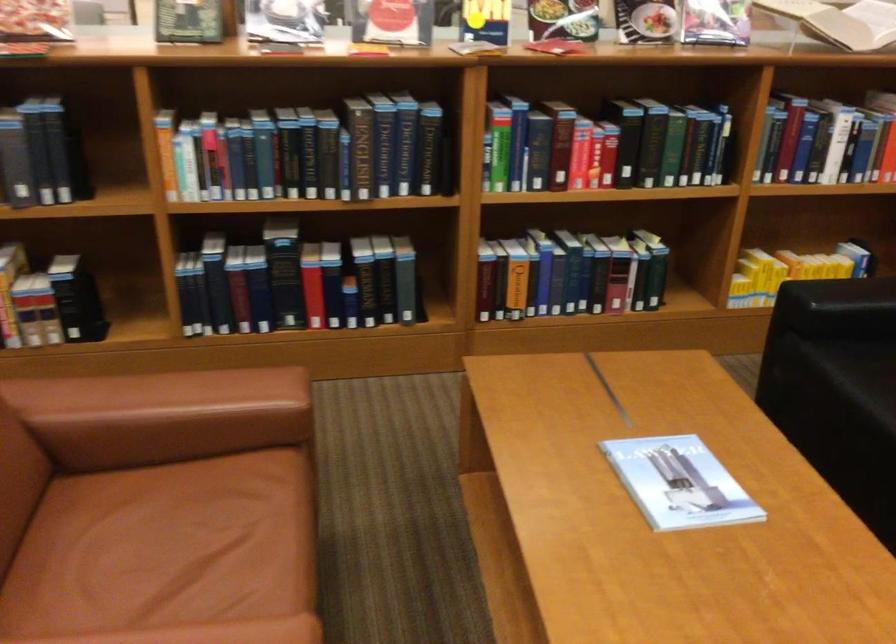
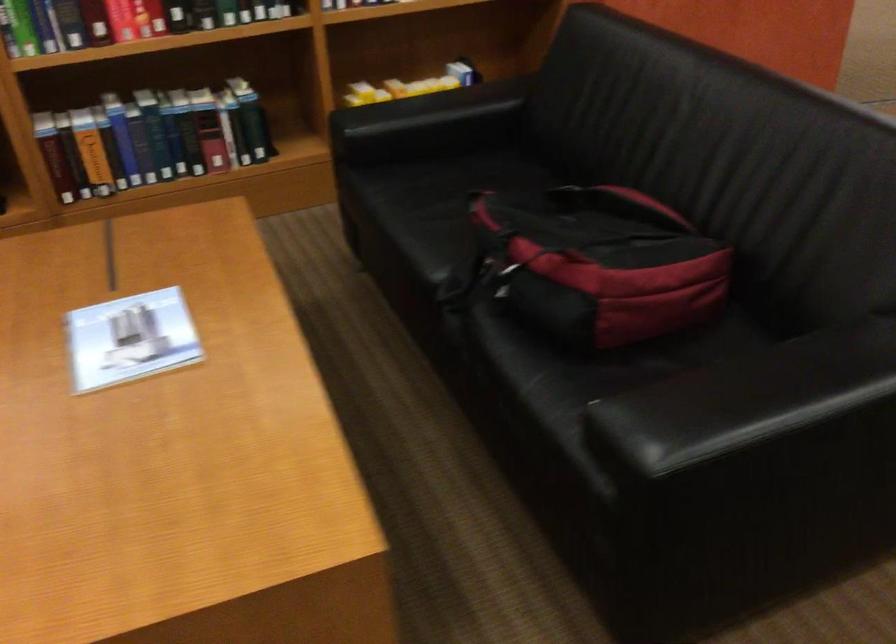
Find the pixel in the second image that matches pixel 664 480 in the first image.

(131, 339)